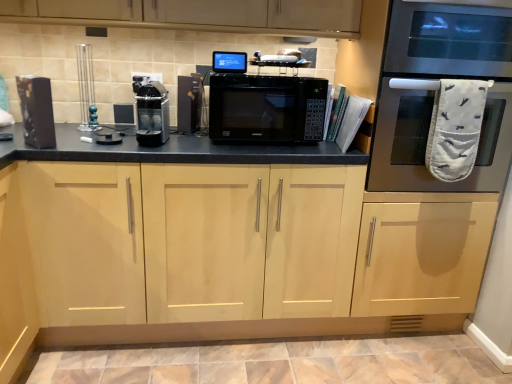
Question: From the image's perspective, is black plastic toaster at center, which is the 3th appliance in left-to-right order, located above stainless steel oven at right?

Choices:
 (A) no
 (B) yes

Answer: (A)

Question: From the image's perspective, would you say black plastic toaster at center, acting as the 1th appliance starting from the right, is shown under stainless steel oven at right?

Choices:
 (A) yes
 (B) no

Answer: (A)

Question: Is black plastic toaster at center, which is the 3th appliance in left-to-right order, taller than stainless steel oven at right?

Choices:
 (A) yes
 (B) no

Answer: (B)

Question: Can you confirm if black plastic toaster at center, which is the 3th appliance in left-to-right order, is positioned to the left of stainless steel oven at right?

Choices:
 (A) yes
 (B) no

Answer: (A)

Question: Does black plastic toaster at center, which is the 3th appliance in left-to-right order, have a lesser height compared to stainless steel oven at right?

Choices:
 (A) no
 (B) yes

Answer: (B)

Question: Would you say black matte microwave at center is to the left or to the right of black plastic coffee machine at center, which ranks as the 2th appliance in left-to-right order, in the picture?

Choices:
 (A) right
 (B) left

Answer: (A)

Question: Looking at the image, does black matte microwave at center seem bigger or smaller compared to black plastic coffee machine at center, placed as the 2th appliance when sorted from right to left?

Choices:
 (A) small
 (B) big

Answer: (B)

Question: Considering the positions of point (224, 89) and point (165, 139), is point (224, 89) closer or farther from the camera than point (165, 139)?

Choices:
 (A) farther
 (B) closer

Answer: (B)

Question: Is black matte microwave at center taller or shorter than black plastic coffee machine at center, placed as the 2th appliance when sorted from right to left?

Choices:
 (A) short
 (B) tall

Answer: (B)

Question: Considering the positions of black matte speaker at left, arranged as the 3th appliance when viewed from the right, and stainless steel oven at right in the image, is black matte speaker at left, arranged as the 3th appliance when viewed from the right, taller or shorter than stainless steel oven at right?

Choices:
 (A) short
 (B) tall

Answer: (A)

Question: Considering the relative positions of black matte speaker at left, arranged as the 3th appliance when viewed from the right, and stainless steel oven at right in the image provided, is black matte speaker at left, arranged as the 3th appliance when viewed from the right, to the left or to the right of stainless steel oven at right?

Choices:
 (A) left
 (B) right

Answer: (A)

Question: Looking at their shapes, would you say black matte speaker at left, arranged as the 3th appliance when viewed from the right, is wider or thinner than stainless steel oven at right?

Choices:
 (A) wide
 (B) thin

Answer: (B)

Question: Choose the correct answer: Is black matte speaker at left, arranged as the 3th appliance when viewed from the right, inside stainless steel oven at right or outside it?

Choices:
 (A) inside
 (B) outside

Answer: (B)

Question: In terms of height, does light wood cabinet at center look taller or shorter compared to black plastic coffee machine at center, which ranks as the 2th appliance in left-to-right order?

Choices:
 (A) tall
 (B) short

Answer: (A)

Question: From the image's perspective, relative to black plastic coffee machine at center, which ranks as the 2th appliance in left-to-right order, is light wood cabinet at center above or below?

Choices:
 (A) below
 (B) above

Answer: (A)